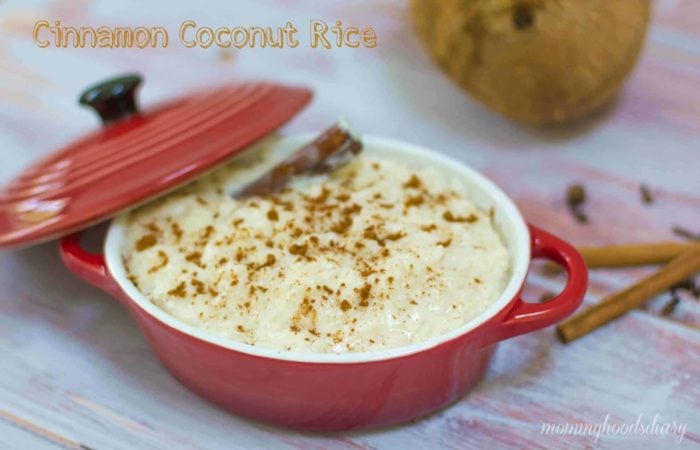
Where is `handle`? The width and height of the screenshot is (700, 450). handle is located at coordinates pyautogui.click(x=584, y=285), pyautogui.click(x=70, y=250).